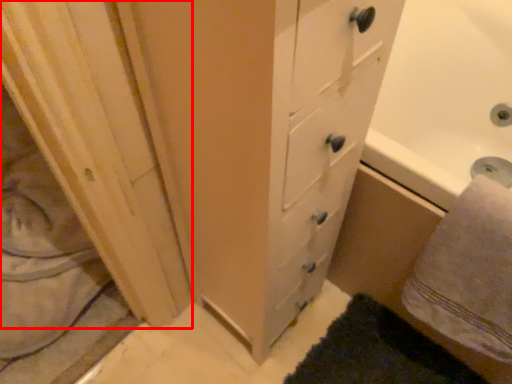
Question: From the image's perspective, what is the correct spatial positioning of screen door (annotated by the red box) in reference to bath towel?

Choices:
 (A) above
 (B) below

Answer: (A)